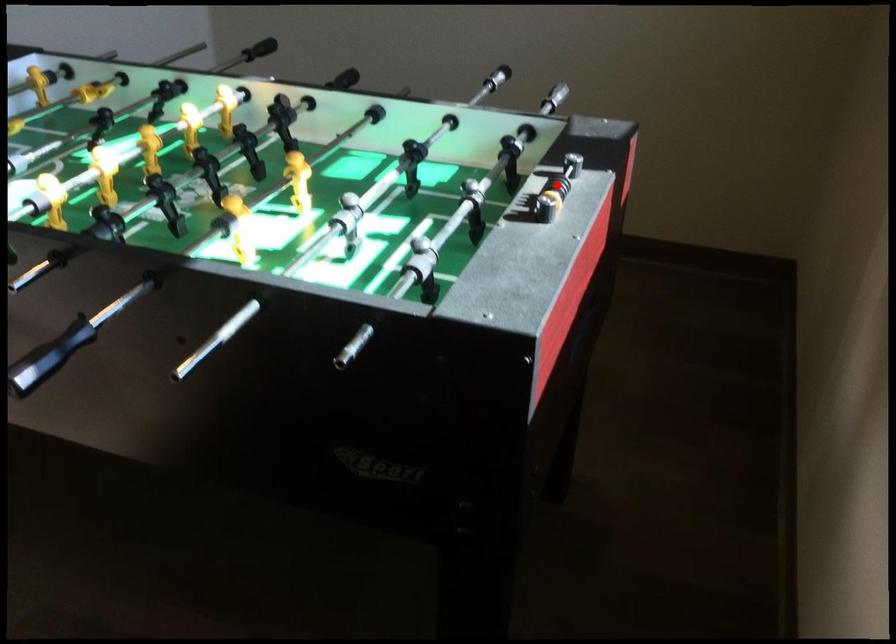
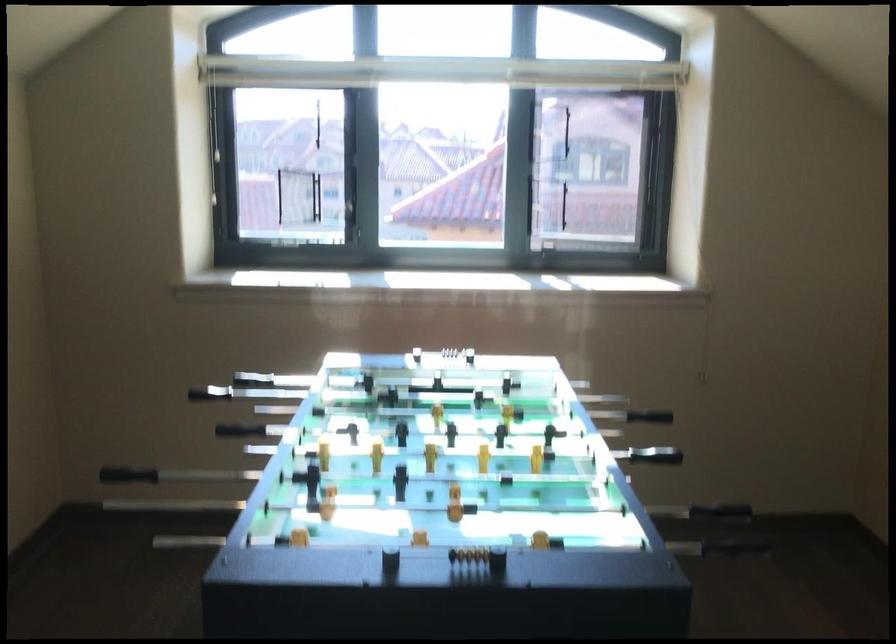
Question: I am providing you with two images of the same scene from different viewpoints. Image1 has a red point marked. In image2, the corresponding 3D location appears at what relative position? Reply with the corresponding letter.

Choices:
 (A) Closer
 (B) Farther

Answer: (B)